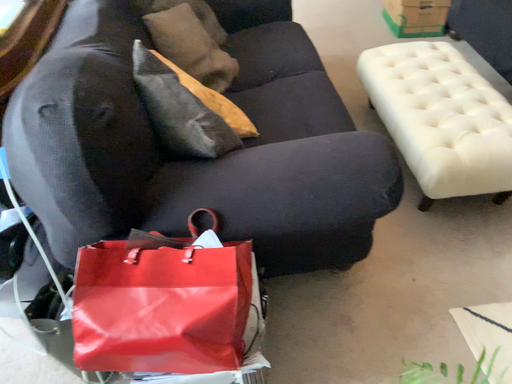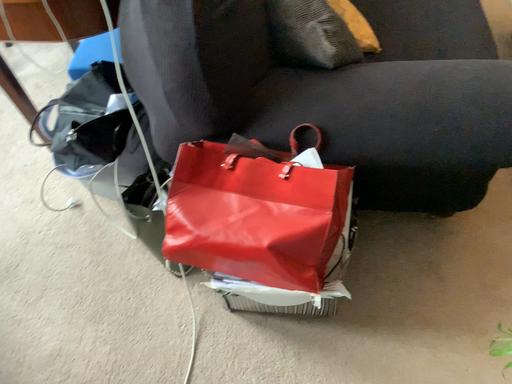
Question: How did the camera likely rotate when shooting the video?

Choices:
 (A) rotated downward
 (B) rotated upward

Answer: (A)